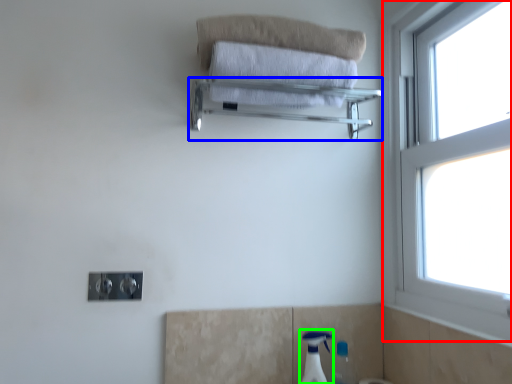
Question: Estimate the real-world distances between objects in this image. Which object is farther from window (highlighted by a red box), balustrade (highlighted by a blue box) or soap dispenser (highlighted by a green box)?

Choices:
 (A) balustrade
 (B) soap dispenser

Answer: (B)